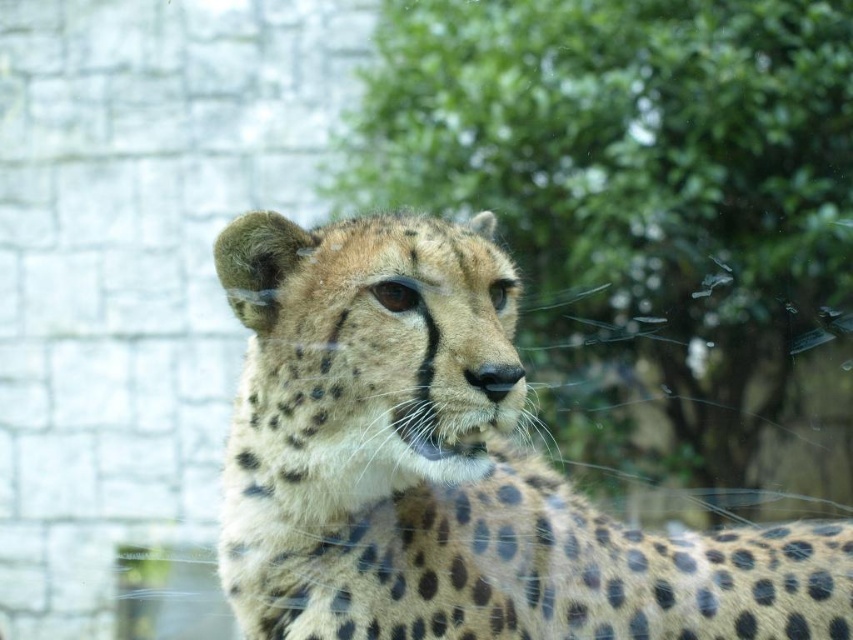
Question: Is green leafy tree at upper center below spotted fur cheetah at center?

Choices:
 (A) yes
 (B) no

Answer: (B)

Question: Does green leafy tree at upper center have a larger size compared to spotted fur cheetah at center?

Choices:
 (A) yes
 (B) no

Answer: (B)

Question: Is green leafy tree at upper center positioned behind spotted fur cheetah at center?

Choices:
 (A) yes
 (B) no

Answer: (A)

Question: Which point is closer to the camera?

Choices:
 (A) spotted fur cheetah at center
 (B) green leafy tree at upper center

Answer: (A)